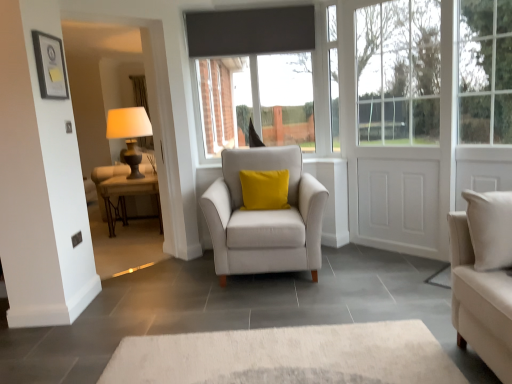
Question: Is matte black table at left in front of white matte door at right?

Choices:
 (A) no
 (B) yes

Answer: (A)

Question: Is matte black table at left aimed at white matte door at right?

Choices:
 (A) no
 (B) yes

Answer: (A)

Question: From a real-world perspective, is matte black table at left under white matte door at right?

Choices:
 (A) yes
 (B) no

Answer: (A)

Question: Does matte black table at left have a smaller size compared to white matte door at right?

Choices:
 (A) yes
 (B) no

Answer: (B)

Question: Considering the relative sizes of matte black table at left and white matte door at right in the image provided, is matte black table at left thinner than white matte door at right?

Choices:
 (A) yes
 (B) no

Answer: (B)

Question: Choose the correct answer: Is matte black table lamp at left inside matte black picture frame at upper left or outside it?

Choices:
 (A) inside
 (B) outside

Answer: (B)

Question: Does point (124, 112) appear closer or farther from the camera than point (41, 54)?

Choices:
 (A) closer
 (B) farther

Answer: (B)

Question: Considering their positions, is matte black table lamp at left located in front of or behind matte black picture frame at upper left?

Choices:
 (A) behind
 (B) front

Answer: (A)

Question: In terms of width, does matte black table lamp at left look wider or thinner when compared to matte black picture frame at upper left?

Choices:
 (A) thin
 (B) wide

Answer: (B)

Question: Is point (373, 66) closer or farther from the camera than point (333, 142)?

Choices:
 (A) closer
 (B) farther

Answer: (A)

Question: Considering the relative positions of white matte door at right and white plastic window frame at upper right in the image provided, is white matte door at right to the left or to the right of white plastic window frame at upper right?

Choices:
 (A) left
 (B) right

Answer: (B)

Question: In the image, is white matte door at right positioned in front of or behind white plastic window frame at upper right?

Choices:
 (A) behind
 (B) front

Answer: (B)

Question: Considering the positions of white matte door at right and white plastic window frame at upper right in the image, is white matte door at right taller or shorter than white plastic window frame at upper right?

Choices:
 (A) short
 (B) tall

Answer: (B)

Question: Considering the positions of white plastic window frame at upper right and matte black picture frame at upper left in the image, is white plastic window frame at upper right taller or shorter than matte black picture frame at upper left?

Choices:
 (A) short
 (B) tall

Answer: (B)

Question: In the image, is white plastic window frame at upper right positioned in front of or behind matte black picture frame at upper left?

Choices:
 (A) front
 (B) behind

Answer: (B)